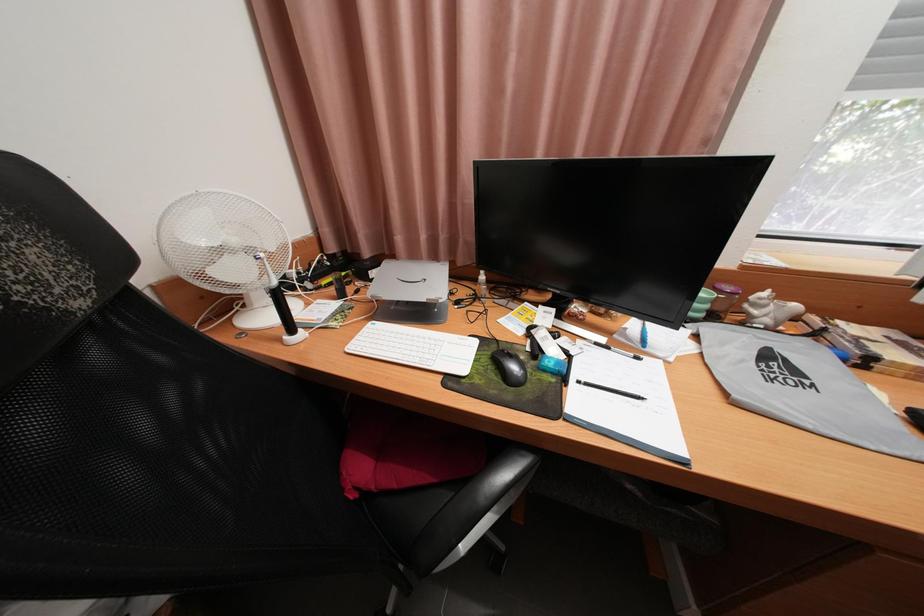
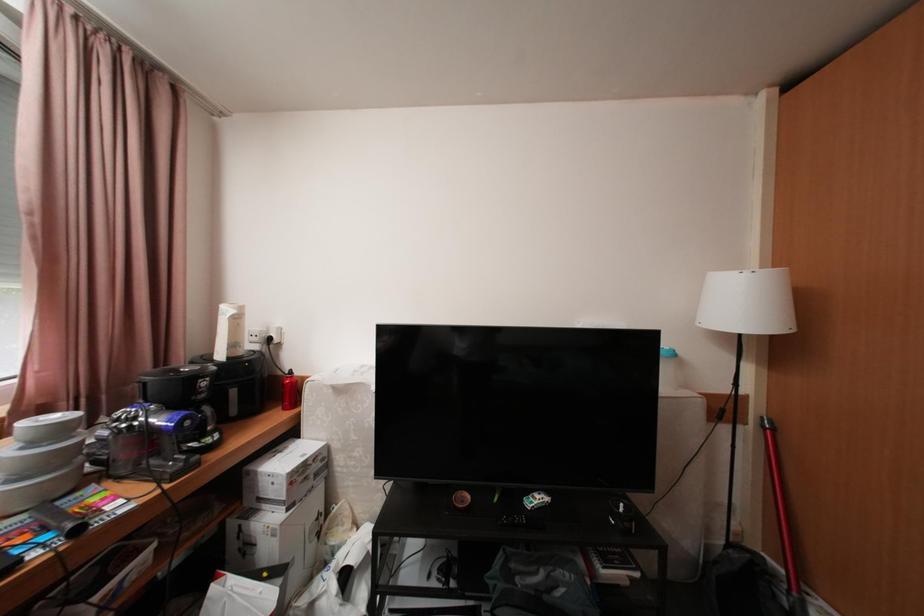
Question: The camera is either moving clockwise (left) or counter-clockwise (right) around the object. The first image is from the beginning of the video and the second image is from the end. Is the camera moving left or right when shooting the video?

Choices:
 (A) Left
 (B) Right

Answer: (A)